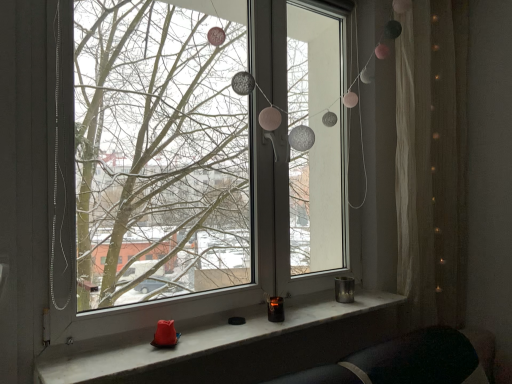
Question: Would you consider transparent glass window at center to be distant from white sheer curtain at right?

Choices:
 (A) yes
 (B) no

Answer: (A)

Question: Would you say white sheer curtain at right is part of transparent glass window at center's contents?

Choices:
 (A) yes
 (B) no

Answer: (B)

Question: From the image's perspective, is transparent glass window at center beneath white sheer curtain at right?

Choices:
 (A) no
 (B) yes

Answer: (A)

Question: Considering the relative sizes of transparent glass window at center and white sheer curtain at right in the image provided, is transparent glass window at center shorter than white sheer curtain at right?

Choices:
 (A) no
 (B) yes

Answer: (B)

Question: Is transparent glass window at center thinner than white sheer curtain at right?

Choices:
 (A) yes
 (B) no

Answer: (A)

Question: Relative to transparent glass window at center, is white sheer curtain at right in front or behind?

Choices:
 (A) behind
 (B) front

Answer: (A)

Question: In terms of size, does white sheer curtain at right appear bigger or smaller than transparent glass window at center?

Choices:
 (A) small
 (B) big

Answer: (A)

Question: Considering the positions of white sheer curtain at right and transparent glass window at center in the image, is white sheer curtain at right taller or shorter than transparent glass window at center?

Choices:
 (A) short
 (B) tall

Answer: (B)

Question: From the image's perspective, is white sheer curtain at right positioned above or below transparent glass window at center?

Choices:
 (A) below
 (B) above

Answer: (A)

Question: Would you say white marble window sill at lower center is to the left or to the right of transparent glass window at center in the picture?

Choices:
 (A) right
 (B) left

Answer: (A)

Question: From a real-world perspective, is white marble window sill at lower center above or below transparent glass window at center?

Choices:
 (A) below
 (B) above

Answer: (A)

Question: Considering the positions of white marble window sill at lower center and transparent glass window at center in the image, is white marble window sill at lower center taller or shorter than transparent glass window at center?

Choices:
 (A) short
 (B) tall

Answer: (A)

Question: Looking at the image, does white marble window sill at lower center seem bigger or smaller compared to transparent glass window at center?

Choices:
 (A) small
 (B) big

Answer: (A)

Question: From the image's perspective, relative to white marble window sill at lower center, is white sheer curtain at right above or below?

Choices:
 (A) above
 (B) below

Answer: (A)

Question: Considering the positions of white sheer curtain at right and white marble window sill at lower center in the image, is white sheer curtain at right taller or shorter than white marble window sill at lower center?

Choices:
 (A) short
 (B) tall

Answer: (B)